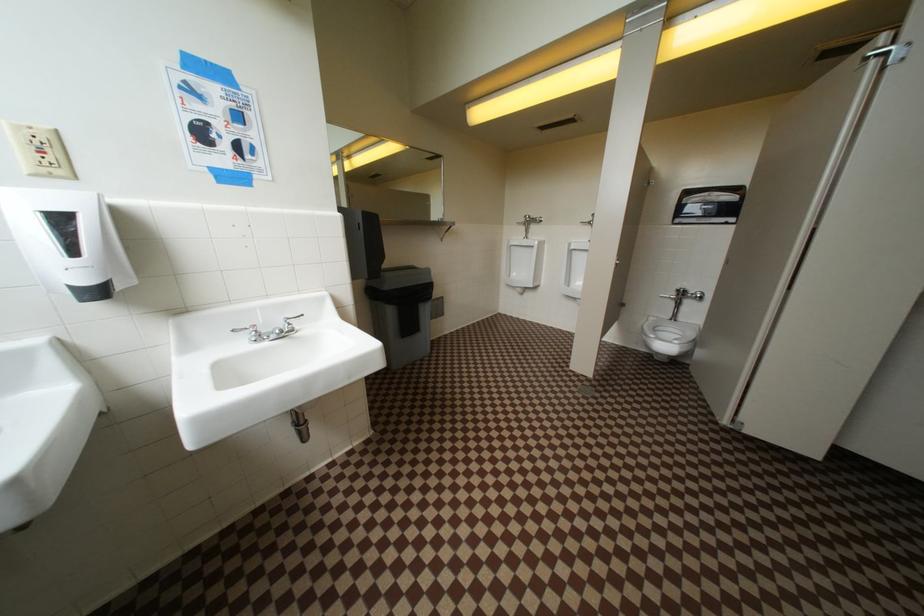
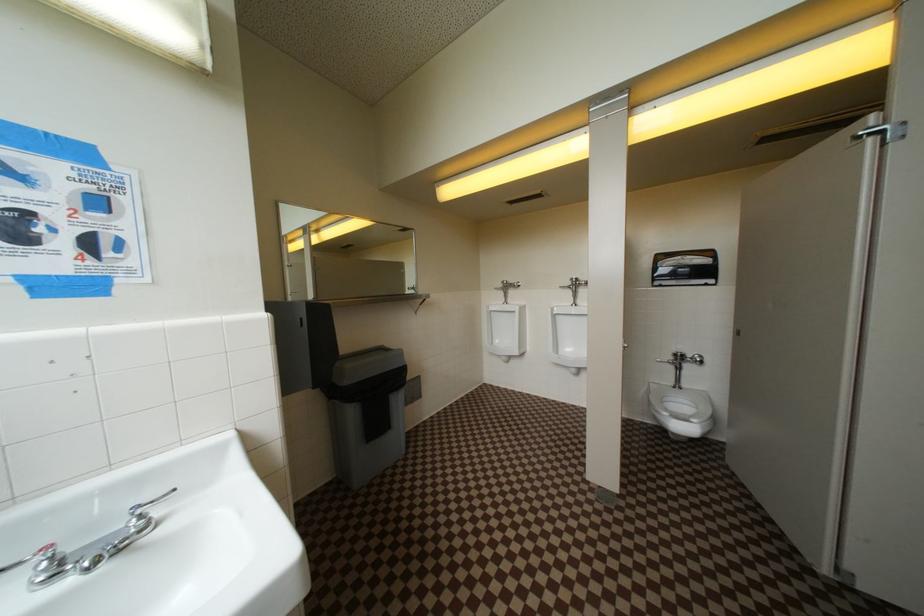
Question: How did the camera likely rotate?

Choices:
 (A) Left
 (B) Right
 (C) Up
 (D) Down

Answer: (C)